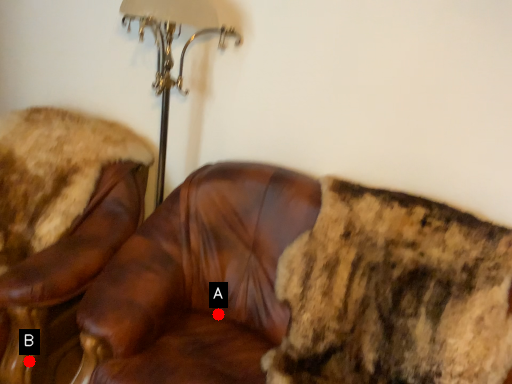
Question: Two points are circled on the image, labeled by A and B beside each circle. Which of the following is the farthest from the observer?

Choices:
 (A) A is further
 (B) B is further

Answer: (A)